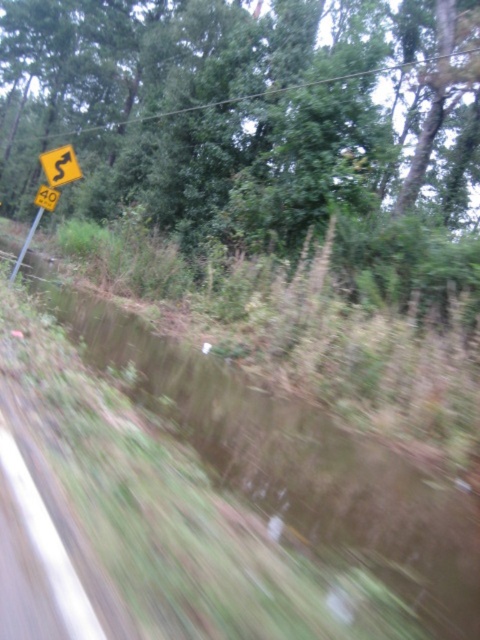
Question: Can you confirm if green leafy tree at upper left is positioned to the left of yellow plastic signpost at left?

Choices:
 (A) yes
 (B) no

Answer: (B)

Question: Is green leafy tree at upper left to the right of brown muddy water at lower left from the viewer's perspective?

Choices:
 (A) yes
 (B) no

Answer: (B)

Question: Based on their relative distances, which object is nearer to the brown muddy water at lower left?

Choices:
 (A) yellow plastic road sign at upper left
 (B) yellow plastic speed limit sign at upper left
 (C) yellow plastic sign at upper left
 (D) yellow plastic signpost at left

Answer: (A)

Question: Which object appears farthest from the camera in this image?

Choices:
 (A) brown muddy water at lower left
 (B) yellow plastic signpost at left
 (C) yellow plastic sign at upper left
 (D) green leafy tree at upper left

Answer: (B)

Question: Which object is closer to the camera taking this photo?

Choices:
 (A) green leafy tree at upper left
 (B) yellow plastic signpost at left
 (C) yellow plastic sign at upper left
 (D) brown muddy water at lower left

Answer: (D)

Question: Can you confirm if green leafy tree at upper left is wider than brown muddy water at lower left?

Choices:
 (A) yes
 (B) no

Answer: (A)